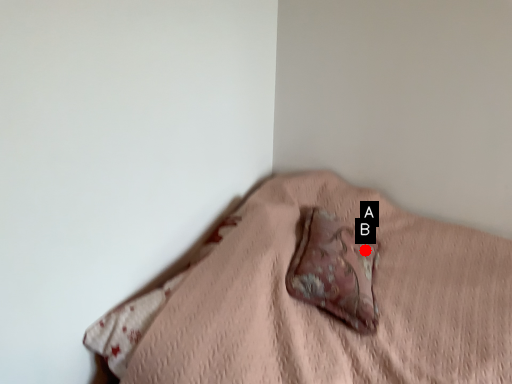
Question: Two points are circled on the image, labeled by A and B beside each circle. Which point is further to the camera?

Choices:
 (A) A is further
 (B) B is further

Answer: (A)